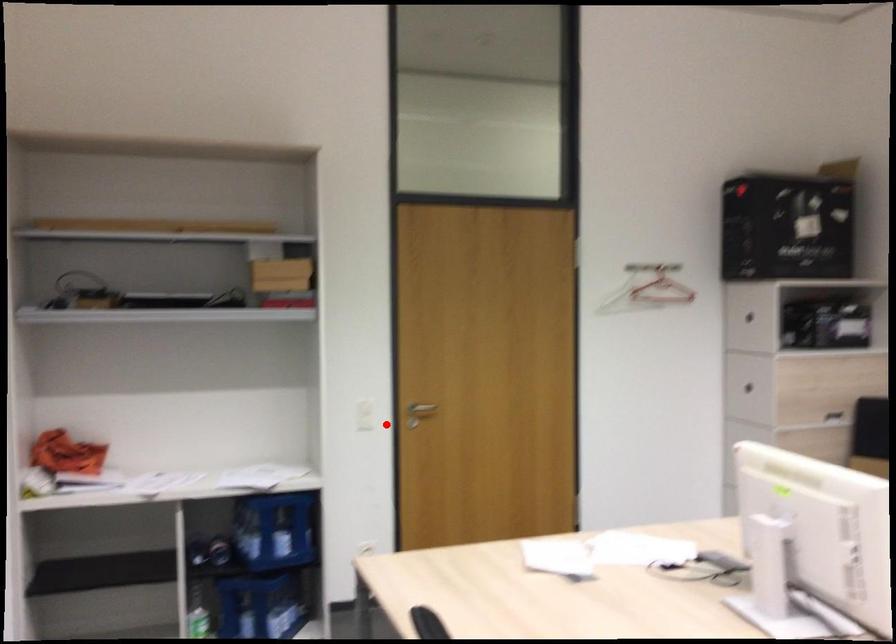
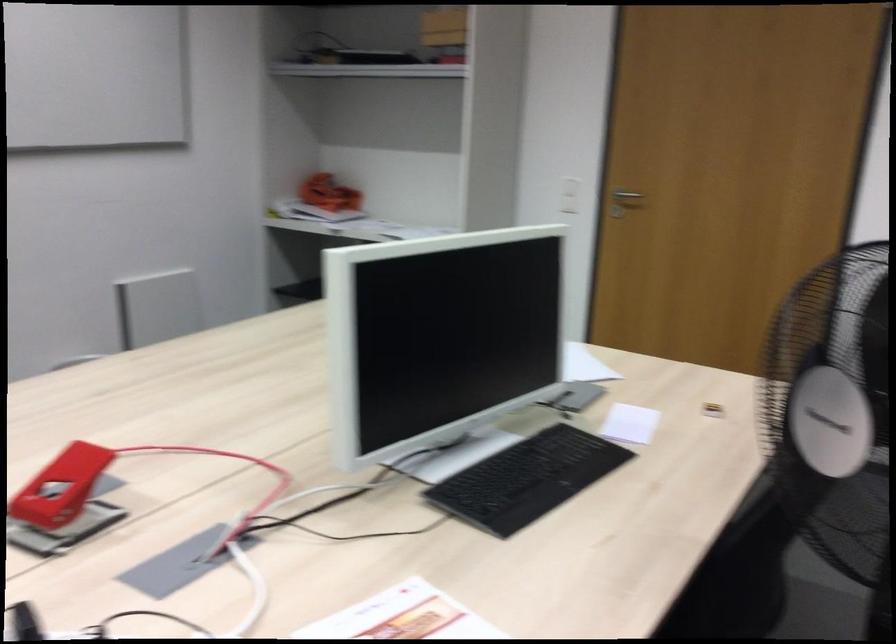
Where in the second image is the point corresponding to the highlighted location from the first image?

(624, 202)